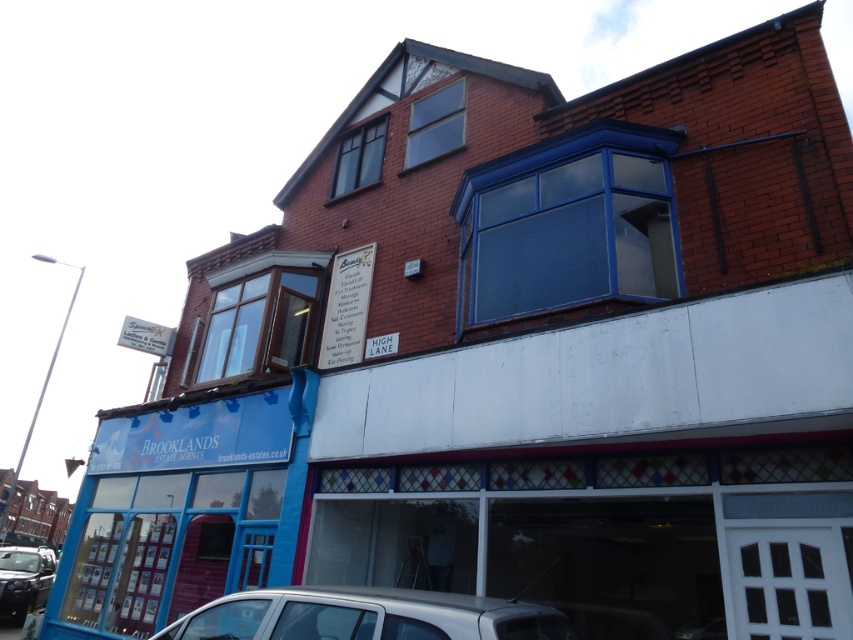
Can you confirm if silver metallic car at lower center is smaller than shiny black car at lower left?

Yes, silver metallic car at lower center is smaller than shiny black car at lower left.

Is silver metallic car at lower center behind shiny black car at lower left?

No.

This screenshot has width=853, height=640. What do you see at coordinates (364, 616) in the screenshot? I see `silver metallic car at lower center` at bounding box center [364, 616].

Locate an element on the screen. silver metallic car at lower center is located at coordinates (x=364, y=616).